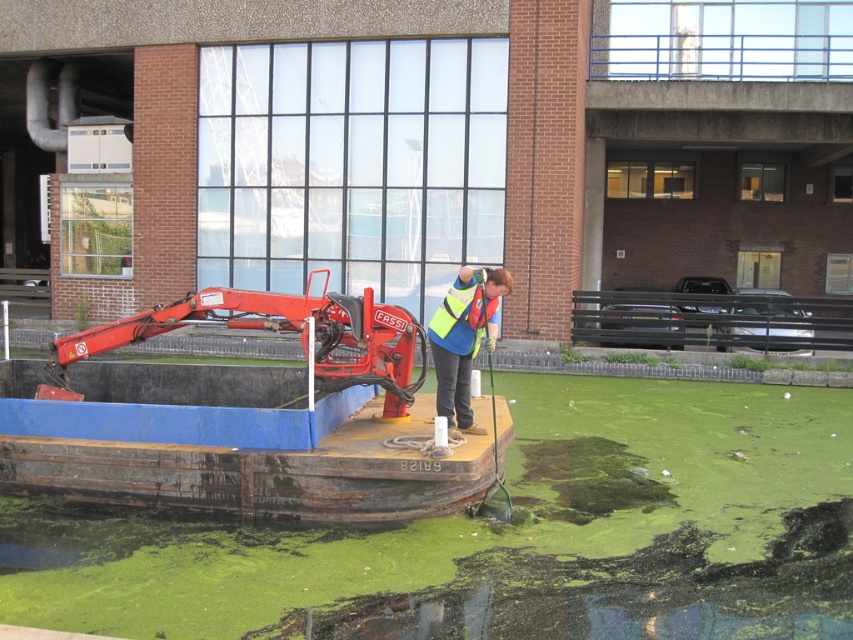
Which is in front, point (567, 608) or point (502, 275)?

Point (567, 608) is in front.

Which is above, green algae at center or reflective yellow vest at center?

reflective yellow vest at center

Between point (505, 582) and point (492, 317), which one is positioned in front?

Positioned in front is point (505, 582).

Locate an element on the screen. green algae at center is located at coordinates (502, 536).

From the picture: Is green algae at center above red metal crane at center?

No.

The height and width of the screenshot is (640, 853). What are the coordinates of `green algae at center` in the screenshot? It's located at (502, 536).

Which is above, green algae at center or high visibility fabric safety vest at center?

high visibility fabric safety vest at center is higher up.

Does point (73, 572) come behind point (426, 330)?

No, it is in front of (426, 330).

Who is more forward, (x=724, y=618) or (x=473, y=289)?

Positioned in front is point (x=724, y=618).

This screenshot has width=853, height=640. In order to click on green algae at center in this screenshot , I will do `click(502, 536)`.